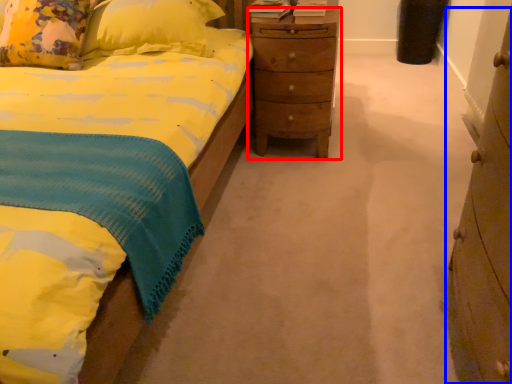
Question: Which object is further to the camera taking this photo, nightstand (highlighted by a red box) or chest of drawers (highlighted by a blue box)?

Choices:
 (A) nightstand
 (B) chest of drawers

Answer: (A)